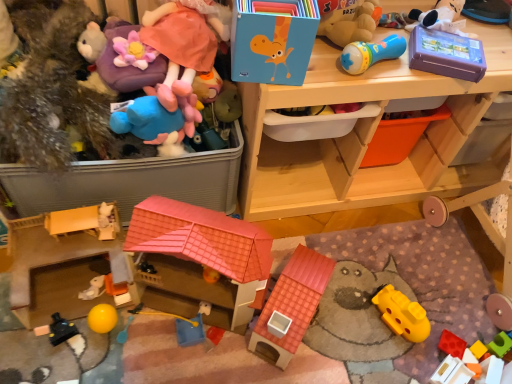
You are a GUI agent. You are given a task and a screenshot of the screen. Output one action in this format:
    pyautogui.click(x=<x>, y=<y>)
    Task: Click on the rubberized red block at lower right, the thirteenth toy viewed from the left
    
    Given the screenshot: What is the action you would take?
    tap(452, 344)

What do you see at coordinates (93, 288) in the screenshot?
I see `white plush toy at lower left, the twelfth toy from the right` at bounding box center [93, 288].

Locate an element on the screen. The height and width of the screenshot is (384, 512). matte plastic toy at center, which is the 5th toy in right-to-left order is located at coordinates (228, 103).

What is the approximate width of matte plastic toy at center, placed as the tenth toy when sorted from left to right?

The width of matte plastic toy at center, placed as the tenth toy when sorted from left to right, is 4.25 inches.

I want to click on rubberized plastic blocks at lower right, placed as the fourteenth toy when sorted from left to right, so click(479, 350).

Is point (179, 86) closer or farther from the camera than point (63, 327)?

Clearly, point (179, 86) is closer to the camera than point (63, 327).

From the picture: Is fluffy plush at upper left, placed as the 9th toy when sorted from left to right, wider or thinner than black plastic toy at lower left, the 13th toy viewed from the right?

Clearly, fluffy plush at upper left, placed as the 9th toy when sorted from left to right, has more width compared to black plastic toy at lower left, the 13th toy viewed from the right.

Is fluffy plush at upper left, which appears as the 6th toy when viewed from the right, shorter than black plastic toy at lower left, positioned as the 2th toy in left-to-right order?

In fact, fluffy plush at upper left, which appears as the 6th toy when viewed from the right, may be taller than black plastic toy at lower left, positioned as the 2th toy in left-to-right order.

Is white plastic toy at lower right, the twelfth toy from the left, in front of or behind fluffy plush at upper left, placed as the 9th toy when sorted from left to right, in the image?

white plastic toy at lower right, the twelfth toy from the left, is behind fluffy plush at upper left, placed as the 9th toy when sorted from left to right.

Based on the photo, is white plastic toy at lower right, the twelfth toy from the left, bigger or smaller than fluffy plush at upper left, which appears as the 6th toy when viewed from the right?

In the image, white plastic toy at lower right, the twelfth toy from the left, appears to be smaller than fluffy plush at upper left, which appears as the 6th toy when viewed from the right.

Is white plastic toy at lower right, the twelfth toy from the left, looking in the opposite direction of fluffy plush at upper left, placed as the 9th toy when sorted from left to right?

white plastic toy at lower right, the twelfth toy from the left, is not turned away from fluffy plush at upper left, placed as the 9th toy when sorted from left to right.

Find the location of a particular element. the 3rd toy to the left of the rubberized plastic microphone at upper right, which is the 11th toy from left to right, counting from the anchor's position is located at coordinates (192, 327).

Considering the relative positions of blue plastic toy at center, the 8th toy viewed from the left, and rubberized plastic microphone at upper right, arranged as the fourth toy when viewed from the right, in the image provided, is blue plastic toy at center, the 8th toy viewed from the left, to the right of rubberized plastic microphone at upper right, arranged as the fourth toy when viewed from the right, from the viewer's perspective?

Incorrect, blue plastic toy at center, the 8th toy viewed from the left, is not on the right side of rubberized plastic microphone at upper right, arranged as the fourth toy when viewed from the right.

Is blue plastic toy at center, the 7th toy viewed from the right, next to rubberized plastic microphone at upper right, arranged as the fourth toy when viewed from the right, and touching it?

blue plastic toy at center, the 7th toy viewed from the right, and rubberized plastic microphone at upper right, arranged as the fourth toy when viewed from the right, are not in contact.

How different are the orientations of blue plastic toy at center, the 7th toy viewed from the right, and rubberized plastic microphone at upper right, which is the 11th toy from left to right, in degrees?

The angle between the facing direction of blue plastic toy at center, the 7th toy viewed from the right, and the facing direction of rubberized plastic microphone at upper right, which is the 11th toy from left to right, is 23.3 degrees.

Is matte blue plush at upper left, which ranks as the seventh toy in left-to-right order, next to rubberized plastic blocks at lower right, placed as the fourteenth toy when sorted from left to right?

No, matte blue plush at upper left, which ranks as the seventh toy in left-to-right order, is not with rubberized plastic blocks at lower right, placed as the fourteenth toy when sorted from left to right.

Does point (174, 115) come in front of point (474, 351)?

Yes, it is in front of point (474, 351).

From the picture: Relative to rubberized plastic blocks at lower right, placed as the fourteenth toy when sorted from left to right, is matte blue plush at upper left, the 8th toy in the right-to-left sequence, in front or behind?

Clearly, matte blue plush at upper left, the 8th toy in the right-to-left sequence, is in front of rubberized plastic blocks at lower right, placed as the fourteenth toy when sorted from left to right.

From the image's perspective, is matte blue plush at upper left, the 8th toy in the right-to-left sequence, located above or below rubberized plastic blocks at lower right, positioned as the first toy in right-to-left order?

matte blue plush at upper left, the 8th toy in the right-to-left sequence, is situated higher than rubberized plastic blocks at lower right, positioned as the first toy in right-to-left order, in the image.

Which is more to the left, fluffy plush at upper left, which appears as the 6th toy when viewed from the right, or white plastic toy at lower right, the twelfth toy from the left?

fluffy plush at upper left, which appears as the 6th toy when viewed from the right.

Which point is more distant from viewer, (119, 40) or (457, 379)?

Point (457, 379)

From a real-world perspective, is fluffy plush at upper left, which appears as the 6th toy when viewed from the right, on top of white plastic toy at lower right, arranged as the 3th toy when viewed from the right?

Indeed, from a real-world perspective, fluffy plush at upper left, which appears as the 6th toy when viewed from the right, stands above white plastic toy at lower right, arranged as the 3th toy when viewed from the right.

Would you say fuzzy brown teddy bear at left, the first toy when ordered from left to right, is outside blue plastic toy at center, the 7th toy viewed from the right?

fuzzy brown teddy bear at left, the first toy when ordered from left to right, is positioned outside blue plastic toy at center, the 7th toy viewed from the right.

Considering the relative positions of fuzzy brown teddy bear at left, the first toy when ordered from left to right, and blue plastic toy at center, the 8th toy viewed from the left, in the image provided, is fuzzy brown teddy bear at left, the first toy when ordered from left to right, to the right of blue plastic toy at center, the 8th toy viewed from the left, from the viewer's perspective?

No, fuzzy brown teddy bear at left, the first toy when ordered from left to right, is not to the right of blue plastic toy at center, the 8th toy viewed from the left.

From a real-world perspective, is fuzzy brown teddy bear at left, which appears as the fourteenth toy when viewed from the right, physically located above or below blue plastic toy at center, the 7th toy viewed from the right?

fuzzy brown teddy bear at left, which appears as the fourteenth toy when viewed from the right, is situated higher than blue plastic toy at center, the 7th toy viewed from the right, in the real world.

Between purple plastic case at upper right, the 1th storage box viewed from the right, and blue plastic toy at center, the 7th toy viewed from the right, which one has less height?

blue plastic toy at center, the 7th toy viewed from the right, is shorter.

Does point (433, 61) appear closer or farther from the camera than point (196, 343)?

Point (433, 61) is closer to the camera than point (196, 343).

From the image's perspective, relative to blue plastic toy at center, the 8th toy viewed from the left, is purple plastic case at upper right, the second storage box when ordered from left to right, above or below?

Based on their image positions, purple plastic case at upper right, the second storage box when ordered from left to right, is located above blue plastic toy at center, the 8th toy viewed from the left.

I want to click on toy that is the 7th one below the fluffy plush at upper left, placed as the 9th toy when sorted from left to right (from a real-world perspective), so click(61, 330).

From a real-world perspective, which toy is the 10th one above the white plastic toy at lower right, arranged as the 3th toy when viewed from the right? Please provide its 2D coordinates.

[(175, 52)]

Based on the photo, based on their spatial positions, is purple plastic case at upper right, the 1th storage box viewed from the right, or fuzzy brown teddy bear at left, the first toy when ordered from left to right, further from matte plastic toy at center, placed as the tenth toy when sorted from left to right?

Based on the image, purple plastic case at upper right, the 1th storage box viewed from the right, appears to be further to matte plastic toy at center, placed as the tenth toy when sorted from left to right.

From the picture: Estimate the real-world distances between objects in this image. Which object is further from rubberized red block at lower right, the thirteenth toy viewed from the left, purple plastic case at upper right, the 1th storage box viewed from the right, or purple plush toy at upper left, which appears as the 6th toy when viewed from the left?

Based on the image, purple plush toy at upper left, which appears as the 6th toy when viewed from the left, appears to be further to rubberized red block at lower right, the thirteenth toy viewed from the left.

Which object lies nearer to the anchor point rubberized plastic blocks at lower right, placed as the fourteenth toy when sorted from left to right, yellow rubber ball at lower left, acting as the 11th toy starting from the right, or black plastic toy at lower left, the 13th toy viewed from the right?

Among the two, yellow rubber ball at lower left, acting as the 11th toy starting from the right, is located nearer to rubberized plastic blocks at lower right, placed as the fourteenth toy when sorted from left to right.

Considering their positions, is matte blue plush at upper left, which ranks as the seventh toy in left-to-right order, positioned further to rubberized plastic microphone at upper right, which is the 11th toy from left to right, than purple plush toy at upper left, which is the ninth toy in right-to-left order?

purple plush toy at upper left, which is the ninth toy in right-to-left order, is further to rubberized plastic microphone at upper right, which is the 11th toy from left to right.

Which object lies further to the anchor point rubberized red block at lower right, the thirteenth toy viewed from the left, wooden toy storage at upper center or fluffy plush at upper left, placed as the 9th toy when sorted from left to right?

fluffy plush at upper left, placed as the 9th toy when sorted from left to right, lies further to rubberized red block at lower right, the thirteenth toy viewed from the left, than the other object.

When comparing their distances from matte plastic toy at center, placed as the tenth toy when sorted from left to right, does white plastic toy at lower right, arranged as the 3th toy when viewed from the right, or blue plastic toy at center, the 7th toy viewed from the right, seem further?

The object further to matte plastic toy at center, placed as the tenth toy when sorted from left to right, is white plastic toy at lower right, arranged as the 3th toy when viewed from the right.

From the image, which object appears to be farther from rubberized plastic microphone at upper right, arranged as the fourth toy when viewed from the right, black plastic toy at lower left, the 13th toy viewed from the right, or matte blue plush at upper left, the 8th toy in the right-to-left sequence?

black plastic toy at lower left, the 13th toy viewed from the right.

Looking at the image, which one is located closer to rubberized red block at lower right, which appears as the 2th toy when viewed from the right, fuzzy brown teddy bear at left, which appears as the fourteenth toy when viewed from the right, or white plastic toy at lower right, arranged as the 3th toy when viewed from the right?

The object closer to rubberized red block at lower right, which appears as the 2th toy when viewed from the right, is white plastic toy at lower right, arranged as the 3th toy when viewed from the right.

At what (x,y) coordinates should I click in order to perform the action: click on storage box between blue matte storage box at upper center, placed as the first storage box when sorted from left to right, and white plastic toy at lower right, arranged as the 3th toy when viewed from the right, in the vertical direction. Please return your answer as a coordinate pair (x, y). This screenshot has height=384, width=512. Looking at the image, I should click on (446, 54).

This screenshot has height=384, width=512. In order to click on shelf located between matte plastic toy house at lower left, which is counted as the tenth toy, starting from the right, and purple plastic case at upper right, the 1th storage box viewed from the right, in the left-right direction in this screenshot , I will do [x=365, y=136].

Identify the location of shelf between matte blue plush at upper left, which ranks as the seventh toy in left-to-right order, and purple plastic case at upper right, the 1th storage box viewed from the right. (365, 136).

Where is `shelf between purple plastic case at upper right, the second storage box when ordered from left to right, and rubberized plastic blocks at lower right, positioned as the first toy in right-to-left order, from top to bottom`? Image resolution: width=512 pixels, height=384 pixels. shelf between purple plastic case at upper right, the second storage box when ordered from left to right, and rubberized plastic blocks at lower right, positioned as the first toy in right-to-left order, from top to bottom is located at coordinates (365, 136).